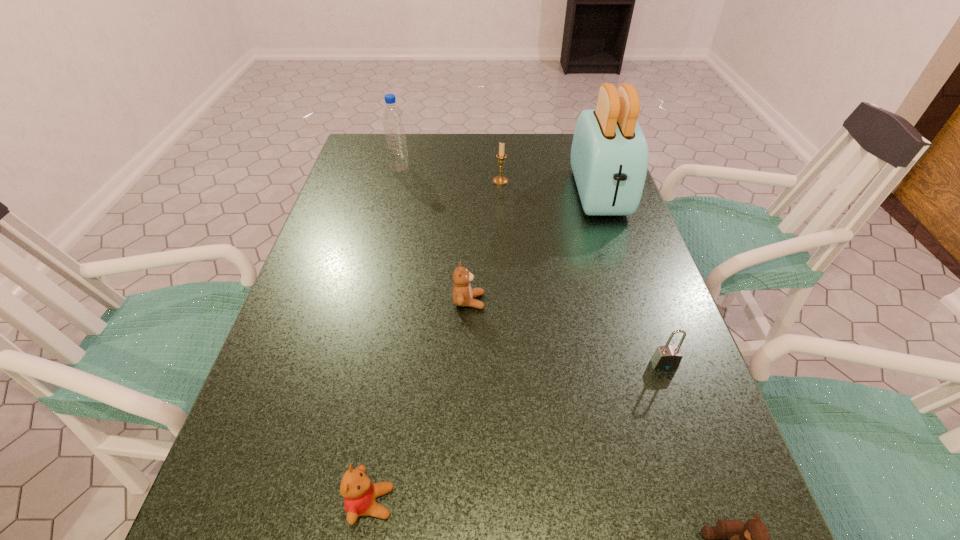
You are a GUI agent. You are given a task and a screenshot of the screen. Output one action in this format:
    pyautogui.click(x=<x>, y=<y>)
    Task: Click on the object that stands as the second closest to the fourth farthest object
    The width and height of the screenshot is (960, 540).
    Given the screenshot: What is the action you would take?
    pyautogui.click(x=667, y=357)

The image size is (960, 540). Find the location of `the closest object relative to the rightmost teddy bear`. the closest object relative to the rightmost teddy bear is located at coordinates (667, 357).

Locate which teddy bear is the second closest to the candle holder. Please provide its 2D coordinates. Your answer should be formatted as a tuple, i.e. [(x, y)], where the tuple contains the x and y coordinates of a point satisfying the conditions above.

[(359, 493)]

Image resolution: width=960 pixels, height=540 pixels. In order to click on teddy bear that stands as the second closest to the farthest teddy bear in this screenshot , I will do pos(752,539).

Identify the location of blank space that satisfies the following two spatial constraints: 1. on the side of the tallest object with the lever; 2. on the front-facing side of the leftmost teddy bear. (702, 502).